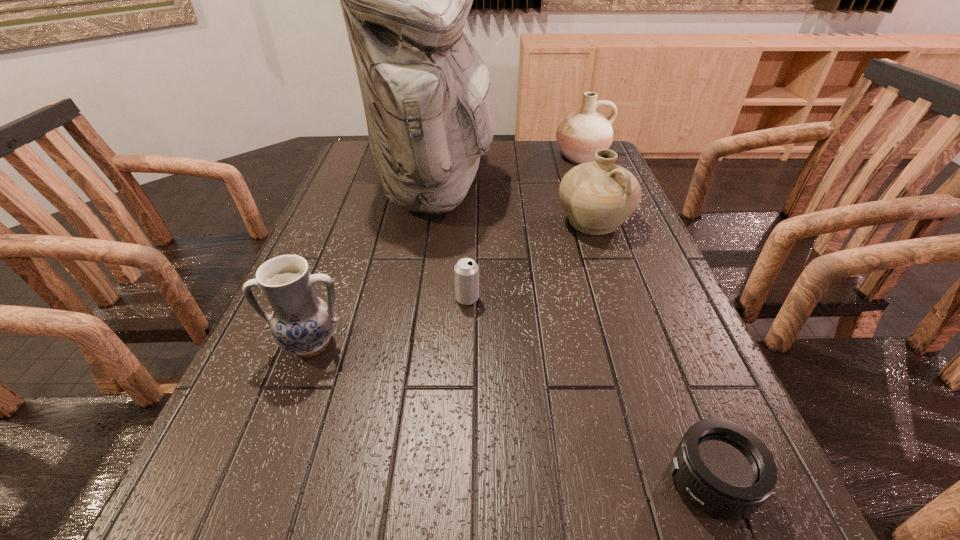
Identify the location of backpack. (430, 105).

Where is `the farthest pottery`? The image size is (960, 540). the farthest pottery is located at coordinates (581, 134).

Identify the location of the second nearest pottery. The height and width of the screenshot is (540, 960). pos(597,197).

Where is `the leftmost pottery`? The image size is (960, 540). the leftmost pottery is located at coordinates (301, 323).

This screenshot has height=540, width=960. Find the location of `the second nearest object`. the second nearest object is located at coordinates (301, 323).

Find the location of a particular element. beer can is located at coordinates (466, 271).

This screenshot has width=960, height=540. I want to click on the fifth tallest object, so click(x=466, y=271).

Where is `telephoto lens`? telephoto lens is located at coordinates (723, 469).

The width and height of the screenshot is (960, 540). Identify the location of the shortest object. (723, 469).

The image size is (960, 540). In order to click on free space located 0.110m on the front-facing side of the tallest object in this screenshot , I will do `click(533, 190)`.